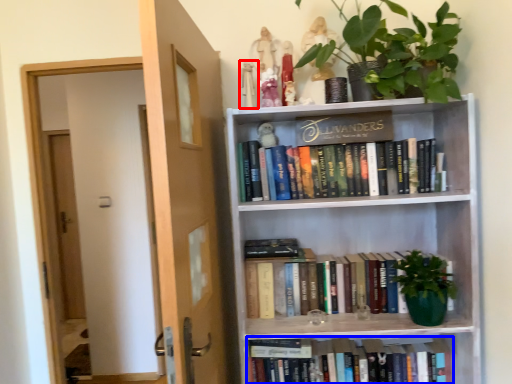
Question: Which of the following is the farthest to the observer, toy (highlighted by a red box) or book (highlighted by a blue box)?

Choices:
 (A) toy
 (B) book

Answer: (B)